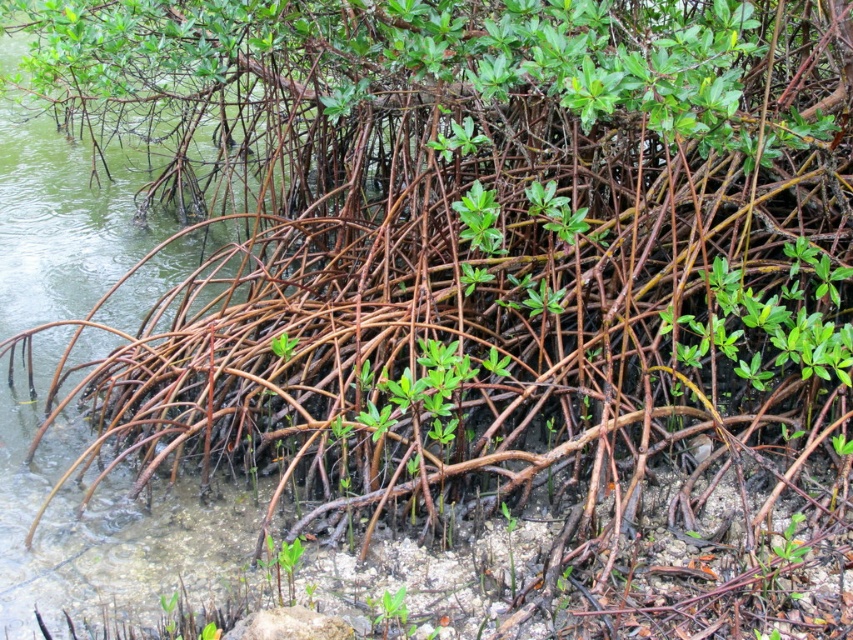
Does green matte leaves at center have a lesser height compared to green matte plant at center?

No, green matte leaves at center is not shorter than green matte plant at center.

Does green matte leaves at center come behind green matte plant at center?

Yes, it is.

At what (x,y) coordinates should I click in order to perform the action: click on green matte leaves at center. Please return your answer as a coordinate pair (x, y). Looking at the image, I should click on (479, 218).